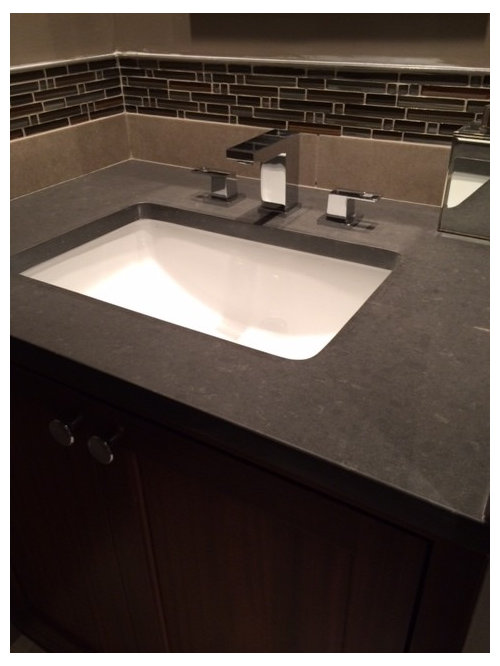
Image resolution: width=500 pixels, height=666 pixels. I want to click on door to cabinet under sink, so click(x=244, y=551), click(x=67, y=517).